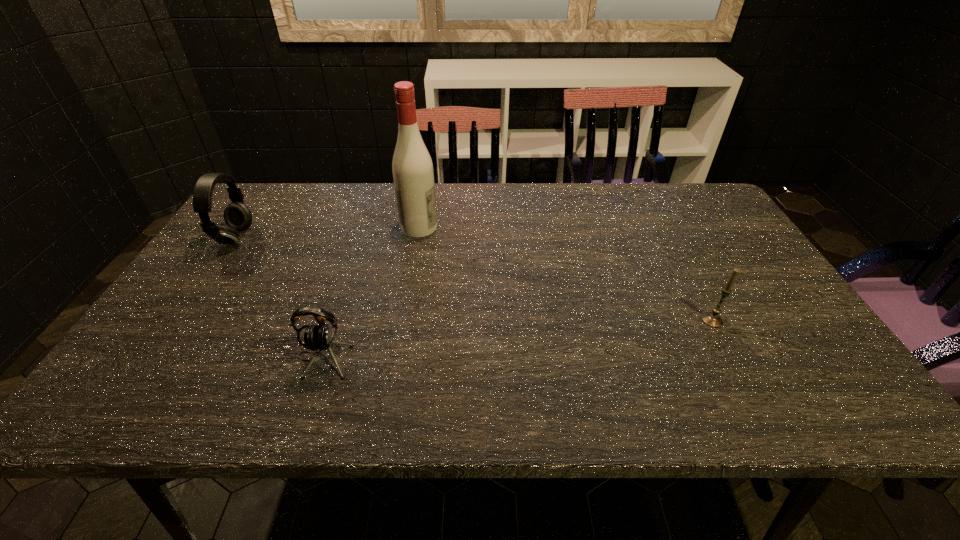
This screenshot has width=960, height=540. What are the coordinates of `vacant area that lies between the nearest object and the third shortest object` in the screenshot? It's located at (279, 298).

At what (x,y) coordinates should I click in order to perform the action: click on unoccupied area between the third farthest object and the leftmost object. Please return your answer as a coordinate pair (x, y). The image size is (960, 540). Looking at the image, I should click on (474, 279).

Image resolution: width=960 pixels, height=540 pixels. In order to click on free space between the tallest object and the right earphone in this screenshot , I will do `click(372, 292)`.

This screenshot has width=960, height=540. Identify the location of free space between the candle and the taller earphone. (474, 279).

Identify which object is located as the third nearest to the rightmost object. Please provide its 2D coordinates. Your answer should be formatted as a tuple, i.e. [(x, y)], where the tuple contains the x and y coordinates of a point satisfying the conditions above.

[(237, 216)]

The height and width of the screenshot is (540, 960). I want to click on object identified as the closest to the tallest object, so click(320, 337).

Locate an element on the screen. free region that satisfies the following two spatial constraints: 1. on the ear cups of the taller earphone; 2. on the left side of the nearest object is located at coordinates (156, 357).

Where is `free space in the image that satisfies the following two spatial constraints: 1. on the ear cups of the left earphone; 2. on the right side of the nearer earphone`? This screenshot has height=540, width=960. free space in the image that satisfies the following two spatial constraints: 1. on the ear cups of the left earphone; 2. on the right side of the nearer earphone is located at coordinates (156, 357).

The image size is (960, 540). In order to click on vacant space that satisfies the following two spatial constraints: 1. on the label of the rightmost object; 2. on the right side of the tallest object in this screenshot , I will do (x=403, y=320).

Where is `vacant area in the image that satisfies the following two spatial constraints: 1. on the label of the alcohol; 2. on the back side of the candle`? vacant area in the image that satisfies the following two spatial constraints: 1. on the label of the alcohol; 2. on the back side of the candle is located at coordinates (403, 320).